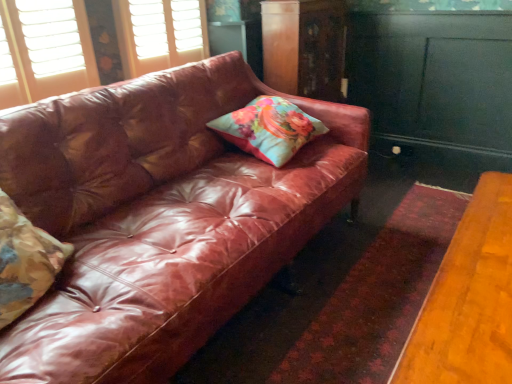
Question: Which direction should I rotate to look at wooden dresser at upper center, placed as the second dresser when sorted from right to left?

Choices:
 (A) right
 (B) left

Answer: (A)

Question: Should I look upward or downward to see shiny brown leather couch at center?

Choices:
 (A) down
 (B) up

Answer: (A)

Question: Is teal painted wood dresser at right, which is counted as the second dresser, starting from the left, at the right side of floral fabric pillow at left, acting as the first pillow starting from the left?

Choices:
 (A) yes
 (B) no

Answer: (A)

Question: From the image's perspective, would you say teal painted wood dresser at right, which is counted as the 1th dresser, starting from the right, is shown under floral fabric pillow at left, acting as the 2th pillow starting from the right?

Choices:
 (A) yes
 (B) no

Answer: (B)

Question: Can you confirm if teal painted wood dresser at right, which is counted as the second dresser, starting from the left, is wider than floral fabric pillow at left, acting as the first pillow starting from the left?

Choices:
 (A) no
 (B) yes

Answer: (A)

Question: Does teal painted wood dresser at right, which is counted as the second dresser, starting from the left, have a lesser height compared to floral fabric pillow at left, acting as the 2th pillow starting from the right?

Choices:
 (A) yes
 (B) no

Answer: (B)

Question: From the image's perspective, does teal painted wood dresser at right, which is counted as the second dresser, starting from the left, appear higher than floral fabric pillow at left, which ranks as the 1th pillow in front-to-back order?

Choices:
 (A) yes
 (B) no

Answer: (A)

Question: Is teal painted wood dresser at right, which is counted as the second dresser, starting from the left, beside floral fabric pillow at left, arranged as the 1th pillow when ordered from the bottom?

Choices:
 (A) no
 (B) yes

Answer: (A)

Question: Could you tell me if floral fabric pillow at left, arranged as the 1th pillow when ordered from the bottom, is facing wooden dresser at upper center, marked as the first dresser in a left-to-right arrangement?

Choices:
 (A) no
 (B) yes

Answer: (A)

Question: Is floral fabric pillow at left, acting as the 2th pillow starting from the right, at the left side of wooden dresser at upper center, placed as the second dresser when sorted from right to left?

Choices:
 (A) no
 (B) yes

Answer: (B)

Question: Is floral fabric pillow at left, acting as the first pillow starting from the left, outside wooden dresser at upper center, placed as the second dresser when sorted from right to left?

Choices:
 (A) no
 (B) yes

Answer: (B)

Question: Can you see floral fabric pillow at left, arranged as the 1th pillow when ordered from the bottom, touching wooden dresser at upper center, marked as the first dresser in a left-to-right arrangement?

Choices:
 (A) yes
 (B) no

Answer: (B)

Question: Is floral fabric pillow at left, acting as the 2th pillow starting from the right, looking in the opposite direction of wooden dresser at upper center, placed as the second dresser when sorted from right to left?

Choices:
 (A) yes
 (B) no

Answer: (B)

Question: Is floral fabric pillow at left, acting as the first pillow starting from the left, not near wooden dresser at upper center, placed as the second dresser when sorted from right to left?

Choices:
 (A) no
 (B) yes

Answer: (B)

Question: Is shiny brown leather couch at center shorter than floral fabric cushion at center, arranged as the 2th pillow when viewed from the front?

Choices:
 (A) no
 (B) yes

Answer: (A)